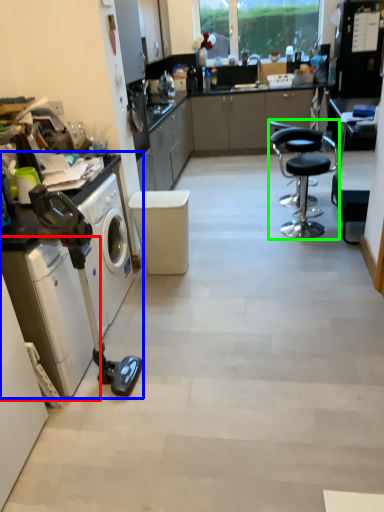
Question: Which object is positioned closest to washing machine (highlighted by a red box)? Select from home appliance (highlighted by a blue box) and chair (highlighted by a green box).

Choices:
 (A) home appliance
 (B) chair

Answer: (A)